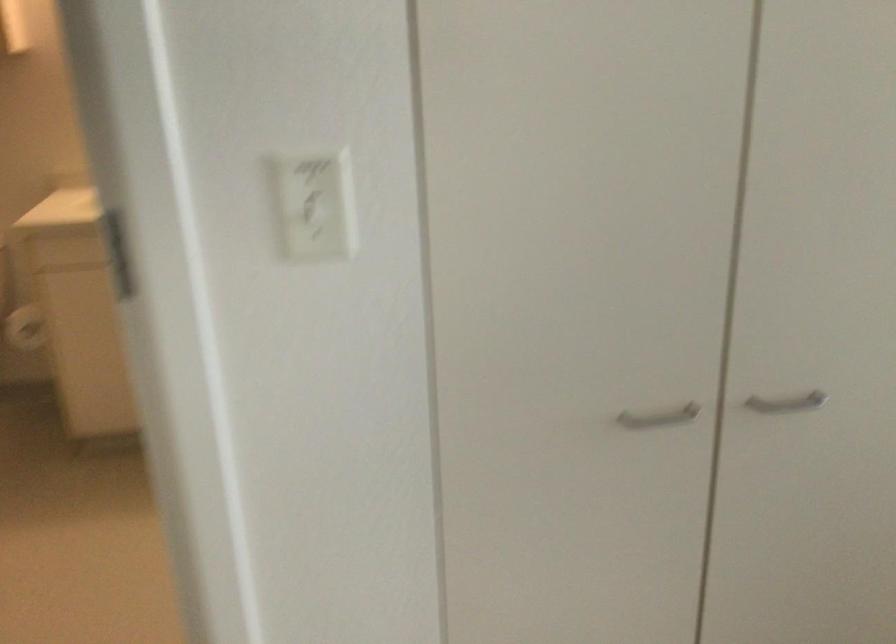
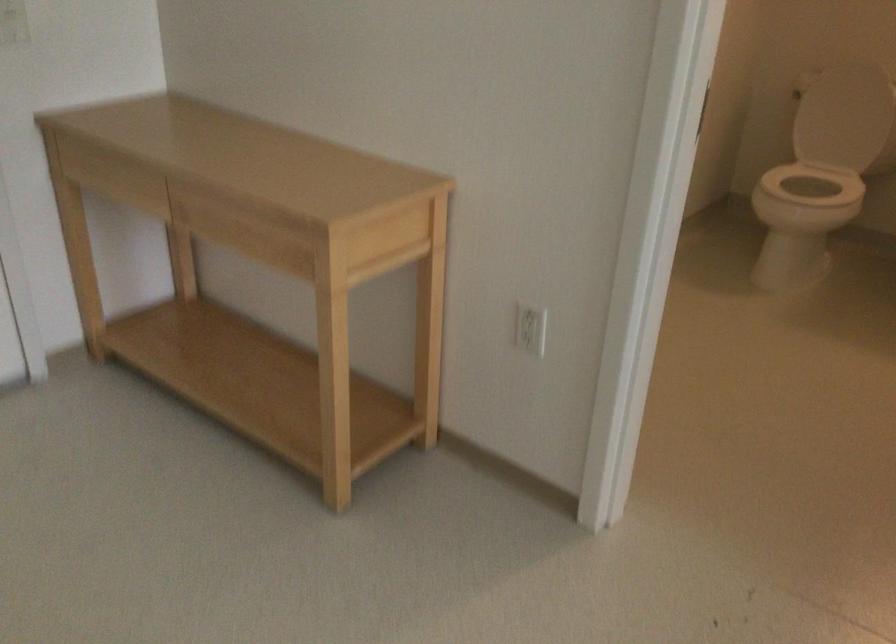
How did the camera likely rotate?

The rotation direction of the camera is left-down.